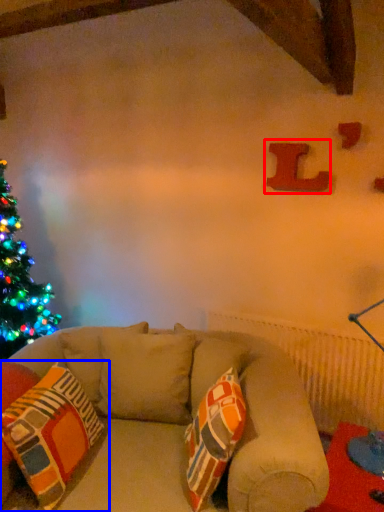
Question: Which object is closer to the camera taking this photo, alphabet (highlighted by a red box) or pillow (highlighted by a blue box)?

Choices:
 (A) alphabet
 (B) pillow

Answer: (B)